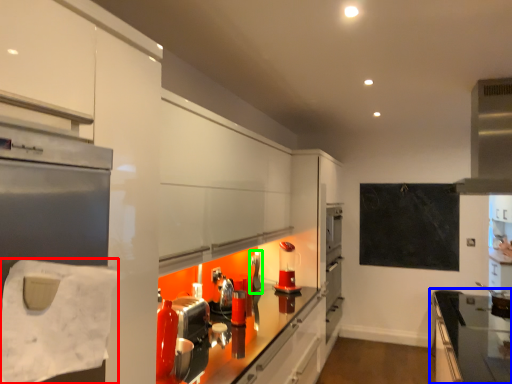
Question: Which is farther away from toilet paper (highlighted by a red box)? countertop (highlighted by a blue box) or appliance (highlighted by a green box)?

Choices:
 (A) countertop
 (B) appliance

Answer: (A)